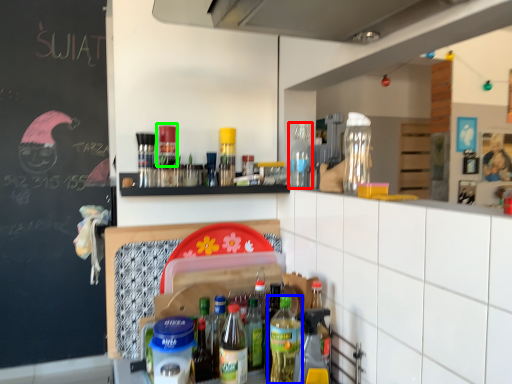
Question: Based on their relative distances, which object is farther from bottle (highlighted by a red box)? Choose from bottle (highlighted by a blue box) and bottle (highlighted by a green box).

Choices:
 (A) bottle
 (B) bottle

Answer: (A)